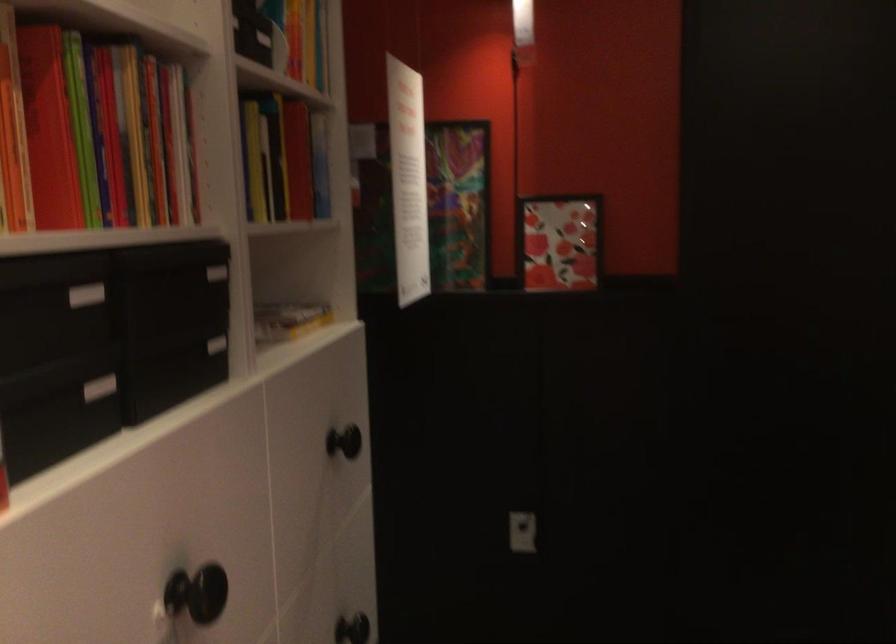
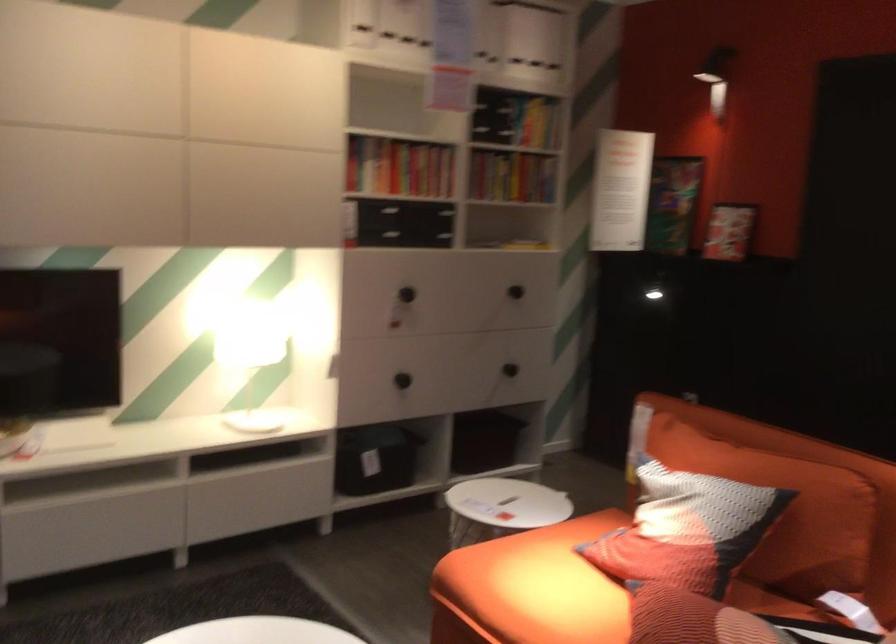
Find the pixel in the second image that matches the point at 274,218 in the first image.

(512, 176)